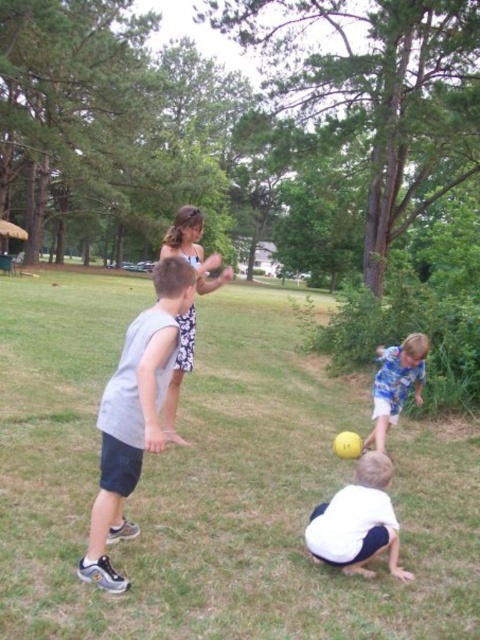
You are standing in the park and see the green grass at center and the blue cotton shirt at lower right. Which object is higher from the ground?

The green grass at center is located above the blue cotton shirt at lower right, so it is higher from the ground.

You are a parent trying to ensure your child stays within a safe zone of 3 meters from you. Your child is wearing the blue cotton shirt at lower right, and you are standing on the green grass at center. Can your child stay within the safe zone without moving?

The distance between the green grass at center and the blue cotton shirt at lower right is exactly 3.04 meters, which is slightly beyond the 3 meter safe zone. Therefore, your child is just outside the safe zone and needs to move closer to stay within the 3 meter limit.